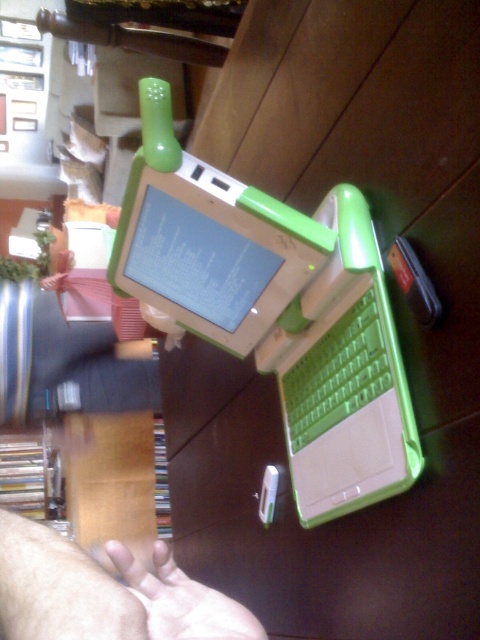
Question: Is green plastic laptop at center positioned behind skinny white hand at lower left?

Choices:
 (A) yes
 (B) no

Answer: (A)

Question: Is green plastic laptop at center wider than skinny white hand at lower left?

Choices:
 (A) no
 (B) yes

Answer: (B)

Question: Which object is closer to the camera taking this photo?

Choices:
 (A) green plastic laptop at center
 (B) skinny white hand at lower left

Answer: (B)

Question: Considering the relative positions of green plastic laptop at center and skinny white hand at lower left in the image provided, where is green plastic laptop at center located with respect to skinny white hand at lower left?

Choices:
 (A) below
 (B) above

Answer: (B)

Question: Which of the following is the closest to the observer?

Choices:
 (A) (144, 588)
 (B) (240, 355)

Answer: (A)